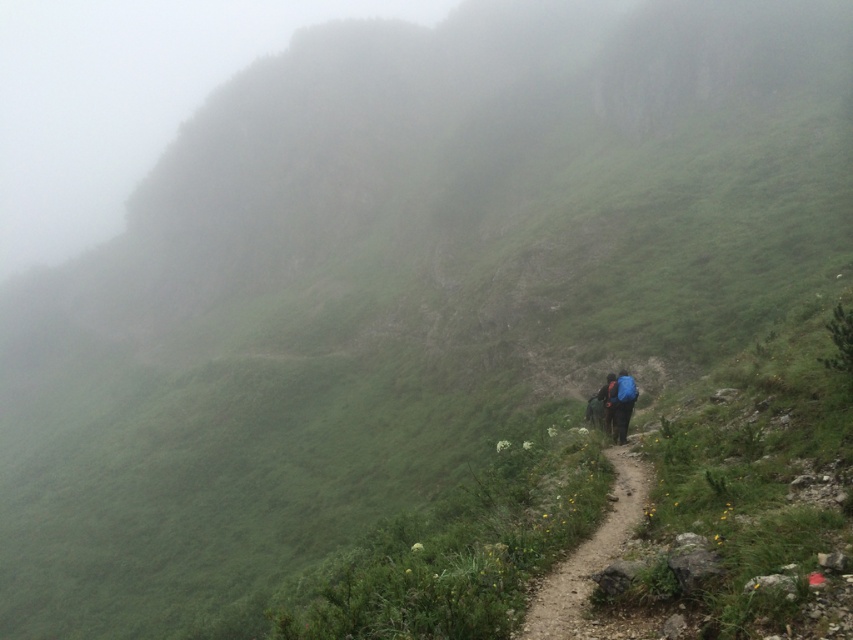
Which is behind, point (631, 406) or point (610, 378)?

Point (610, 378)

Who is more distant from viewer, (x=619, y=412) or (x=611, y=426)?

Positioned behind is point (x=611, y=426).

This screenshot has width=853, height=640. Identify the location of blue fabric backpack at lower center. pos(624,403).

Image resolution: width=853 pixels, height=640 pixels. Describe the element at coordinates (589, 557) in the screenshot. I see `dirt path at center` at that location.

Can you confirm if dirt path at center is positioned above blue fabric backpack at lower center?

Actually, dirt path at center is below blue fabric backpack at lower center.

Who is more forward, (549, 621) or (614, 388)?

Positioned in front is point (549, 621).

The height and width of the screenshot is (640, 853). In order to click on dirt path at center in this screenshot , I will do `click(589, 557)`.

Does dirt path at center have a greater height compared to orange fabric backpack at center?

Incorrect, dirt path at center's height is not larger of orange fabric backpack at center's.

Does point (532, 636) come in front of point (608, 376)?

That is True.

This screenshot has width=853, height=640. I want to click on dirt path at center, so click(589, 557).